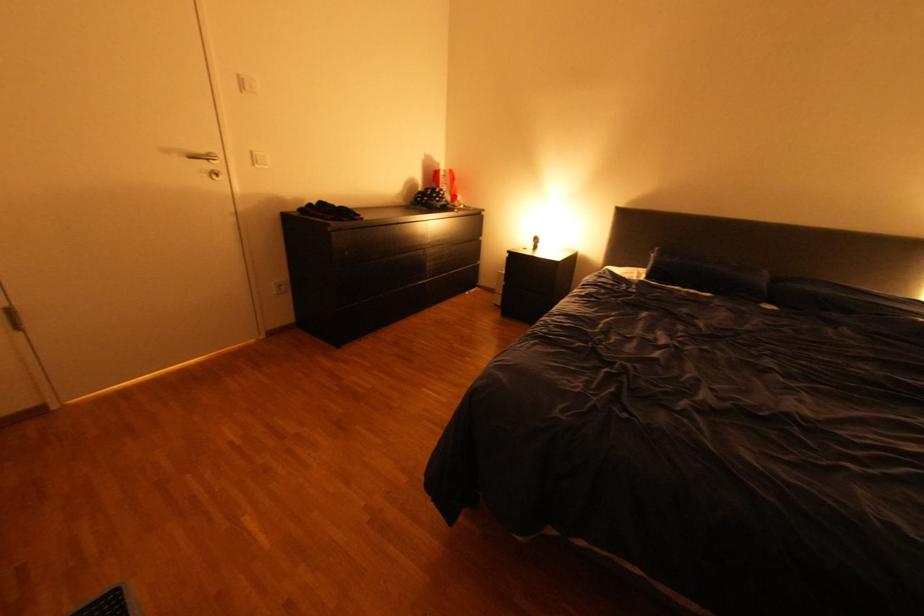
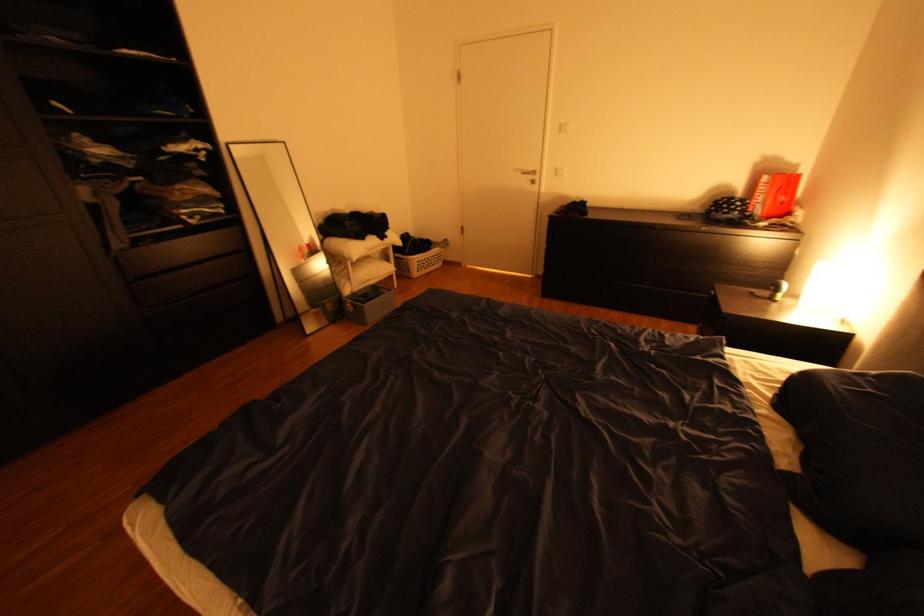
The point at the highlighted location is marked in the first image. Where is the corresponding point in the second image?

(748, 208)